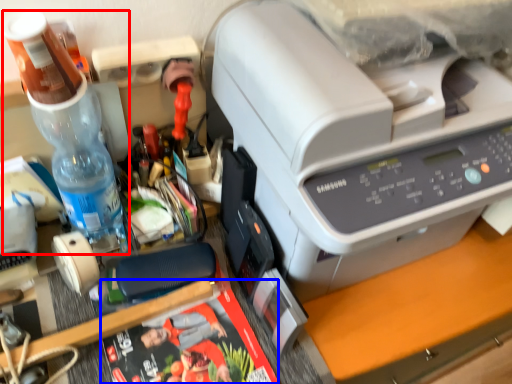
Question: Among these objects, which one is nearest to the camera, bottle (highlighted by a red box) or magazine (highlighted by a blue box)?

Choices:
 (A) bottle
 (B) magazine

Answer: (A)